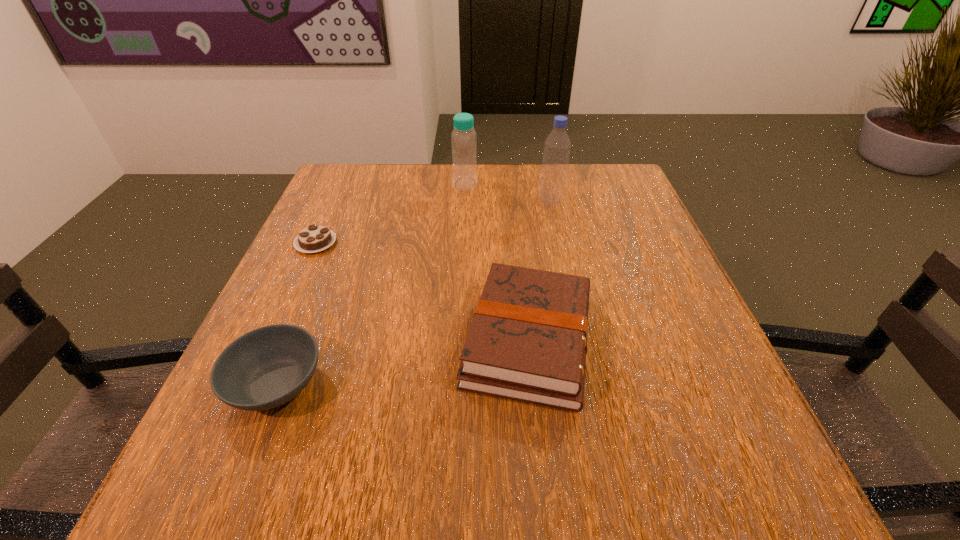
This screenshot has height=540, width=960. What are the coordinates of `the fourth nearest object` in the screenshot? It's located at (557, 146).

You are a GUI agent. You are given a task and a screenshot of the screen. Output one action in this format:
    pyautogui.click(x=<x>, y=<y>)
    Task: Click on the right bottle
    This screenshot has height=540, width=960.
    Given the screenshot: What is the action you would take?
    pyautogui.click(x=557, y=146)

The height and width of the screenshot is (540, 960). What are the coordinates of `the farther bottle` in the screenshot? It's located at (463, 138).

Find the location of a particular element. Image resolution: width=960 pixels, height=540 pixels. the shorter bottle is located at coordinates (463, 138).

Find the location of a particular element. This screenshot has width=960, height=540. hardback book is located at coordinates (528, 339).

Find the location of a particular element. The height and width of the screenshot is (540, 960). soup bowl is located at coordinates (267, 367).

Locate an element on the screen. The height and width of the screenshot is (540, 960). chocolate cake is located at coordinates (314, 238).

Locate an element on the screen. The height and width of the screenshot is (540, 960). the third farthest object is located at coordinates (314, 238).

Find the location of a particular element. vacant region located on the left of the nearer bottle is located at coordinates (431, 201).

You are a GUI agent. You are given a task and a screenshot of the screen. Output one action in this format:
    pyautogui.click(x=<x>, y=<y>)
    Task: Click on the vacant space situated on the right of the shorter bottle
    The image size is (960, 540).
    Given the screenshot: What is the action you would take?
    pyautogui.click(x=523, y=184)